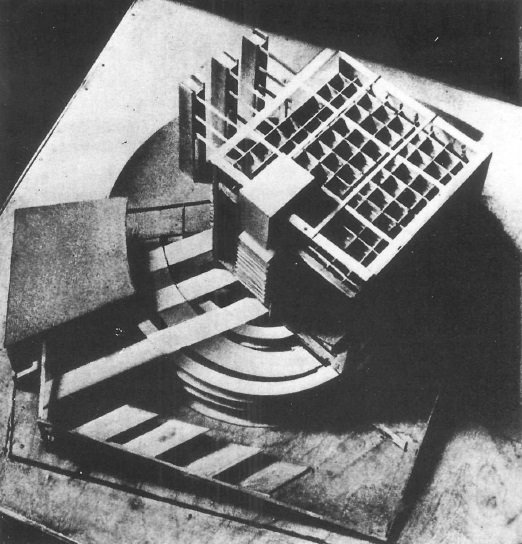
At what (x,y) coordinates should I click in order to perform the action: click on looks like marble design. Please return your answer as a coordinate pair (x, y). Looking at the image, I should click on (486, 476).